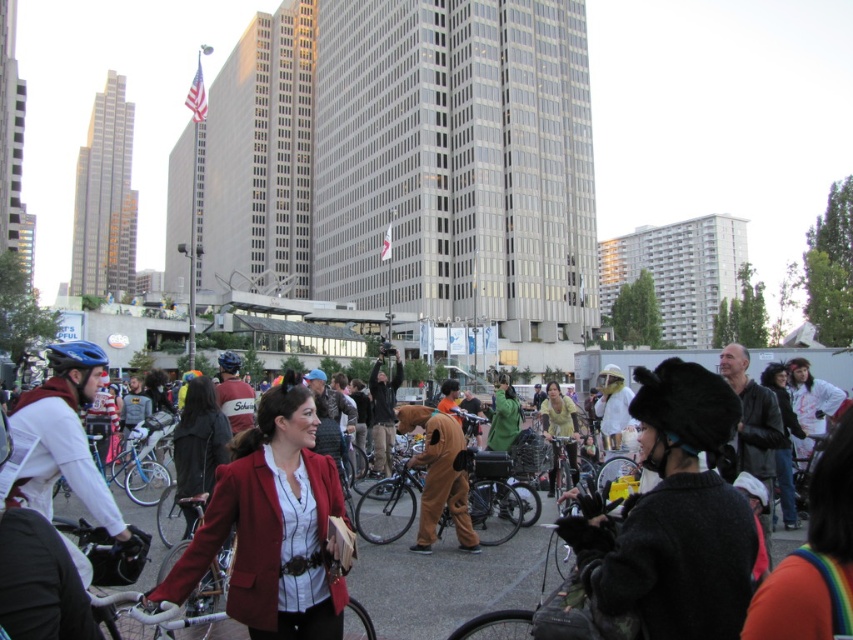
You are a photographer at the event and want to capture both the brown furry costume at center and the blue matte bicycle helmet at center in a single frame. Since you can only focus on one object, which one should you choose to ensure the other appears smaller in the photo?

The brown furry costume at center is smaller than the blue matte bicycle helmet at center. To ensure the other appears smaller, focus on the blue matte bicycle helmet at center because the smaller object will naturally appear smaller when the larger one is in focus.

You are standing in the city square and want to reach the point marked at coordinates (360, 497). If you can walk 3 feet per second, how long will it take you to reach that point?

The point marked at coordinates (360, 497) is 160.07 feet away from you. At a walking speed of 3 feet per second, it would take approximately 53.36 seconds to reach that point.